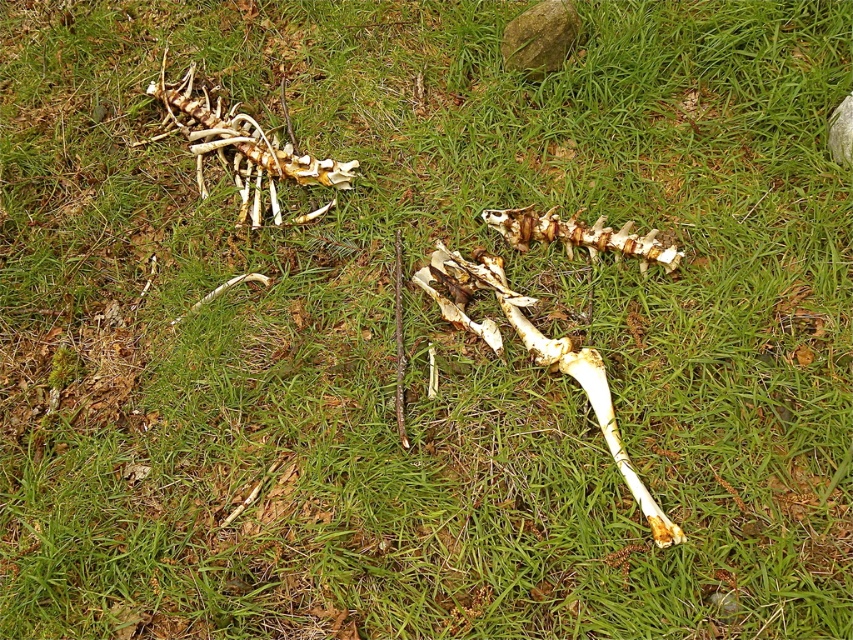
Question: Which point appears farthest from the camera in this image?

Choices:
 (A) (570, 225)
 (B) (281, 212)

Answer: (B)

Question: Which point is farther from the camera taking this photo?

Choices:
 (A) (665, 540)
 (B) (531, 220)
 (C) (260, 161)

Answer: (C)

Question: Which point is farther to the camera?

Choices:
 (A) (454, 317)
 (B) (583, 234)
 (C) (221, 116)

Answer: (C)

Question: Can you confirm if white bone at upper left is positioned to the right of white bone at center?

Choices:
 (A) no
 (B) yes

Answer: (A)

Question: Is white bone at upper left smaller than white bone at center?

Choices:
 (A) yes
 (B) no

Answer: (B)

Question: Where is white bone at upper left located in relation to yellowish bone at center in the image?

Choices:
 (A) right
 (B) left

Answer: (B)